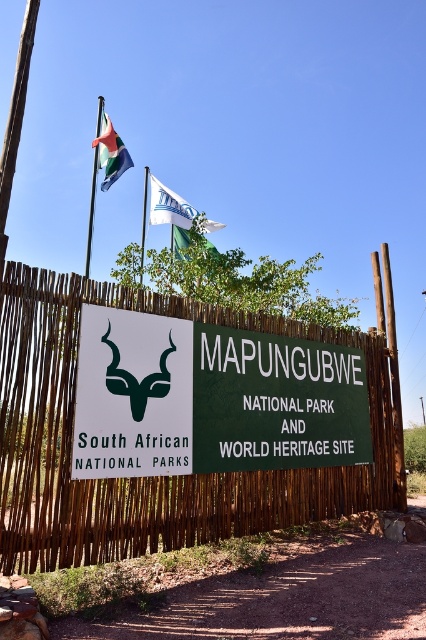
Between point (345, 355) and point (144, 168), which one is positioned behind?

Positioned behind is point (144, 168).

Can you confirm if green matte sign at center is wider than green fabric flag at upper left?

Indeed, green matte sign at center has a greater width compared to green fabric flag at upper left.

What do you see at coordinates (210, 397) in the screenshot? I see `green matte sign at center` at bounding box center [210, 397].

Where is `green matte sign at center`? Image resolution: width=426 pixels, height=640 pixels. green matte sign at center is located at coordinates (210, 397).

Which is more to the right, green matte sign at center or white fabric flag at upper center?

Positioned to the right is green matte sign at center.

Does green matte sign at center appear over white fabric flag at upper center?

No.

Consider the image. Measure the distance between green matte sign at center and camera.

green matte sign at center is 4.69 meters away from camera.

This screenshot has height=640, width=426. In order to click on green matte sign at center in this screenshot , I will do `click(210, 397)`.

Does point (115, 134) come closer to viewer compared to point (141, 243)?

That is True.

At what (x,y) coordinates should I click in order to perform the action: click on polyester flag at upper left. Please return your answer as a coordinate pair (x, y). Looking at the image, I should click on (111, 152).